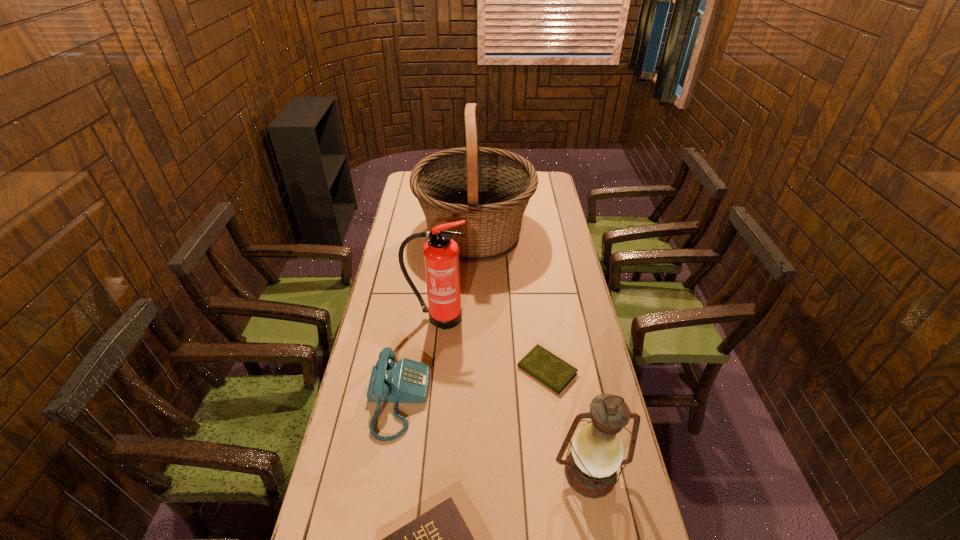
I want to click on the tallest object, so click(x=489, y=188).

Locate an element on the screen. The height and width of the screenshot is (540, 960). basket is located at coordinates (489, 188).

Locate an element on the screen. the fifth shortest object is located at coordinates (441, 253).

At what (x,y) coordinates should I click in order to perform the action: click on the second farthest object. Please return your answer as a coordinate pair (x, y). This screenshot has height=540, width=960. Looking at the image, I should click on (441, 253).

Identify the location of oil lamp. This screenshot has height=540, width=960. pyautogui.click(x=591, y=467).

Where is `the third shortest object`? The height and width of the screenshot is (540, 960). the third shortest object is located at coordinates (407, 381).

The height and width of the screenshot is (540, 960). I want to click on diary, so click(544, 366).

The image size is (960, 540). I want to click on vacant space located on the front of the basket, so click(472, 343).

The height and width of the screenshot is (540, 960). What are the coordinates of `vacant region located 0.320m at the nozzle of the second farthest object` in the screenshot? It's located at (428, 410).

Locate an element on the screen. vacant region located 0.110m on the back of the fourth shortest object is located at coordinates (578, 408).